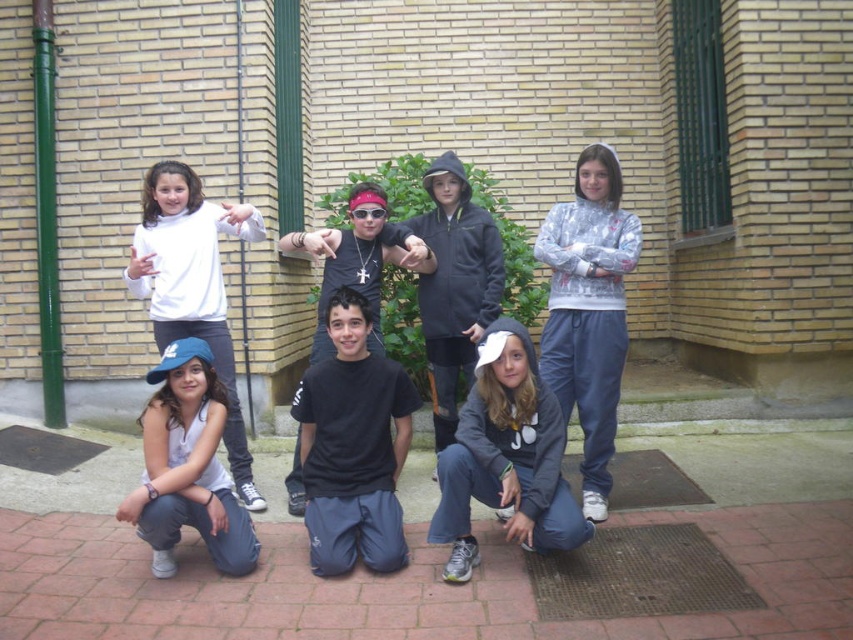
Who is more forward, (492,364) or (212,236)?

Point (492,364) is more forward.

Does gray hoodie at center have a smaller size compared to white matte sweatshirt at upper left?

Yes.

Locate an element on the screen. This screenshot has width=853, height=640. gray hoodie at center is located at coordinates (506, 458).

This screenshot has height=640, width=853. What are the coordinates of `black matte t-shirt at center` in the screenshot? It's located at (352, 445).

Which is above, black matte t-shirt at center or white fabric tank top at lower left?

black matte t-shirt at center is above.

The height and width of the screenshot is (640, 853). What are the coordinates of `black matte t-shirt at center` in the screenshot? It's located at (352, 445).

Is white fabric tank top at lower left shorter than white matte sweatshirt at upper left?

Yes.

Describe the element at coordinates (187, 467) in the screenshot. The width and height of the screenshot is (853, 640). I see `white fabric tank top at lower left` at that location.

Who is more distant from viewer, (171, 520) or (144, 268)?

The point (144, 268) is behind.

Locate an element on the screen. This screenshot has width=853, height=640. white fabric tank top at lower left is located at coordinates (187, 467).